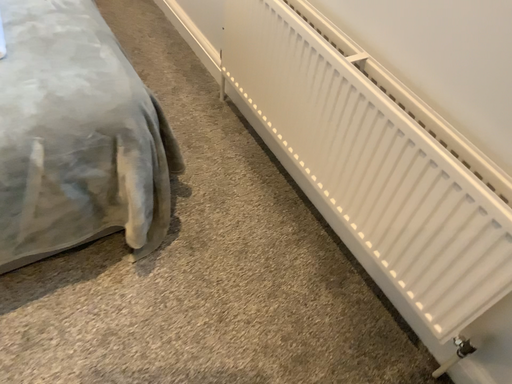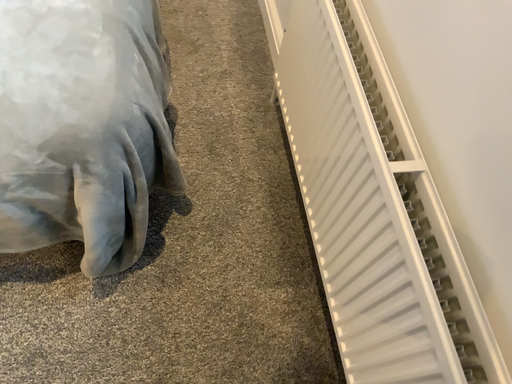
Question: Which way did the camera rotate in the video?

Choices:
 (A) rotated left
 (B) rotated right

Answer: (A)